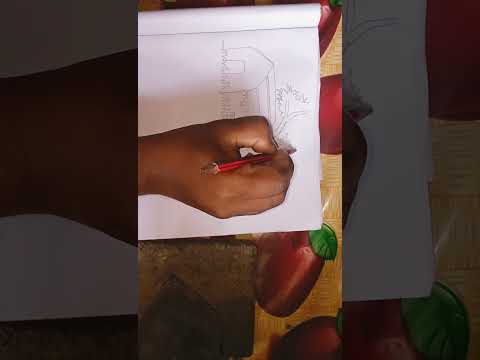
You are a GUI agent. You are given a task and a screenshot of the screen. Output one action in this format:
    pyautogui.click(x=<x>, y=<y>)
    Task: Click on the art
    
    Given the screenshot: What is the action you would take?
    pyautogui.click(x=294, y=278)